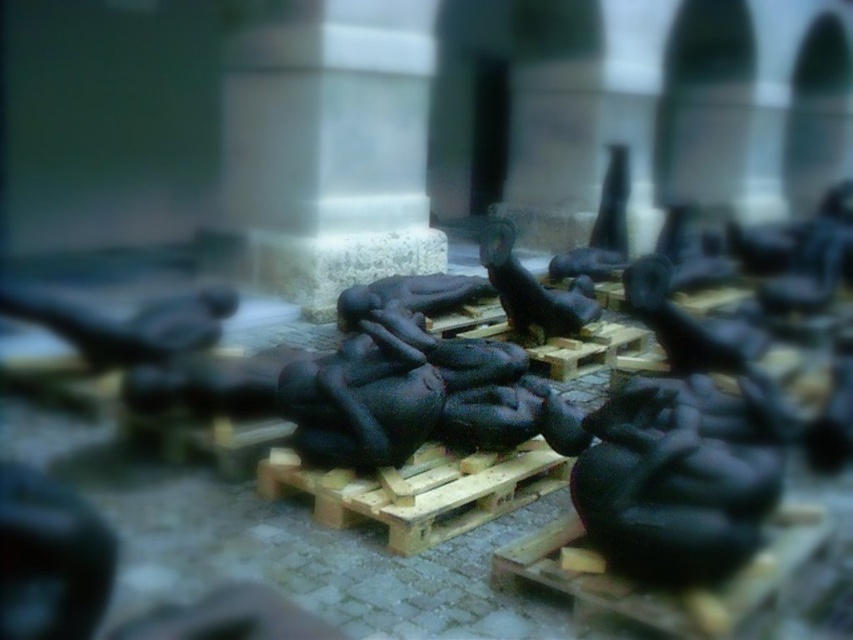
Who is positioned more to the left, matte gray stone at center or matte black sculpture at center?

From the viewer's perspective, matte gray stone at center appears more on the left side.

Does matte gray stone at center appear over matte black sculpture at center?

Yes.

Measure the distance between point [387,168] and camera.

3.59 meters

At what (x,y) coordinates should I click in order to perform the action: click on matte gray stone at center. Please return your answer as a coordinate pair (x, y). Looking at the image, I should click on (331, 147).

Between matte gray stone at center and black rubber sculpture at center, which one is positioned higher?

matte gray stone at center is higher up.

Which of these two, matte gray stone at center or black rubber sculpture at center, stands shorter?

black rubber sculpture at center

The image size is (853, 640). I want to click on matte gray stone at center, so click(x=331, y=147).

Does matte black sculpture at center have a greater height compared to black rubber sculpture at center?

Incorrect, matte black sculpture at center's height is not larger of black rubber sculpture at center's.

Between point (527, 292) and point (608, 269), which one is positioned behind?

Point (608, 269)

You are a GUI agent. You are given a task and a screenshot of the screen. Output one action in this format:
    pyautogui.click(x=<x>, y=<y>)
    Task: Click on the matte black sculpture at center
    This screenshot has height=640, width=853.
    Given the screenshot: What is the action you would take?
    pyautogui.click(x=532, y=289)